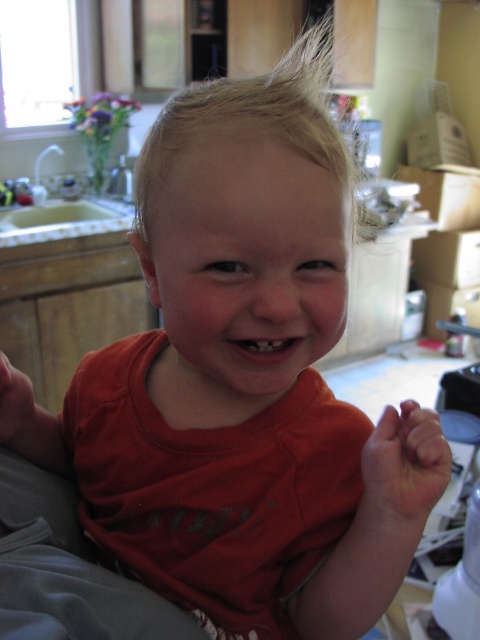
Question: Does smooth skin hand at lower right have a lesser width compared to matte orange shirt at lower left?

Choices:
 (A) yes
 (B) no

Answer: (B)

Question: Which point appears farthest from the camera in this image?

Choices:
 (A) (7, 433)
 (B) (407, 481)

Answer: (A)

Question: Does smooth skin hand at lower right lie behind matte orange shirt at lower left?

Choices:
 (A) no
 (B) yes

Answer: (A)

Question: Which point is closer to the camera taking this photo?

Choices:
 (A) (25, 390)
 (B) (376, 435)

Answer: (B)

Question: Is smooth skin hand at lower right smaller than matte orange shirt at lower left?

Choices:
 (A) no
 (B) yes

Answer: (B)

Question: Which point appears farthest from the camera in this image?

Choices:
 (A) (38, 426)
 (B) (392, 477)

Answer: (A)